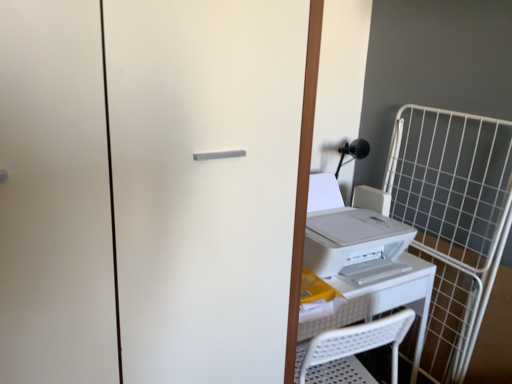
Question: Is white plastic printer at right turned away from white wire cage at right?

Choices:
 (A) no
 (B) yes

Answer: (A)

Question: Is white plastic printer at right positioned beyond the bounds of white wire cage at right?

Choices:
 (A) yes
 (B) no

Answer: (A)

Question: From the image's perspective, does white plastic printer at right appear lower than white wire cage at right?

Choices:
 (A) yes
 (B) no

Answer: (B)

Question: Is white plastic printer at right smaller than white wire cage at right?

Choices:
 (A) no
 (B) yes

Answer: (A)

Question: Does white plastic printer at right have a larger size compared to white wire cage at right?

Choices:
 (A) yes
 (B) no

Answer: (A)

Question: Can you confirm if white plastic printer at right is positioned to the left of white wire cage at right?

Choices:
 (A) no
 (B) yes

Answer: (B)

Question: Considering the relative sizes of white plastic printer at right and white plastic table at center in the image provided, is white plastic printer at right shorter than white plastic table at center?

Choices:
 (A) no
 (B) yes

Answer: (B)

Question: Is white plastic printer at right taller than white plastic table at center?

Choices:
 (A) yes
 (B) no

Answer: (B)

Question: From the image's perspective, would you say white plastic printer at right is positioned over white plastic table at center?

Choices:
 (A) yes
 (B) no

Answer: (A)

Question: Does white plastic printer at right have a smaller size compared to white plastic table at center?

Choices:
 (A) no
 (B) yes

Answer: (B)

Question: Is white plastic printer at right wider than white plastic table at center?

Choices:
 (A) yes
 (B) no

Answer: (B)

Question: Is white plastic printer at right not inside white plastic table at center?

Choices:
 (A) yes
 (B) no

Answer: (A)

Question: Could you tell me if white plastic table at center is facing white plastic printer at right?

Choices:
 (A) yes
 (B) no

Answer: (B)